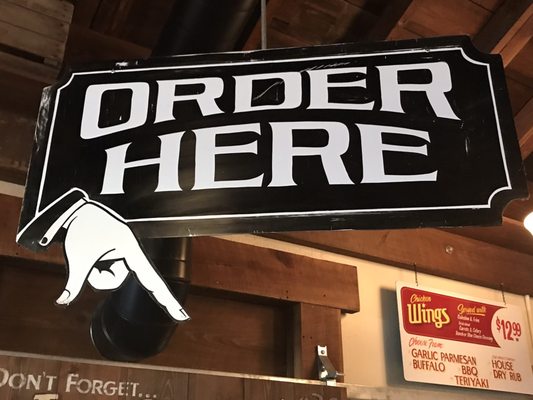
Find the location of a particular element. This screenshot has height=400, width=533. cream wall is located at coordinates (369, 347).